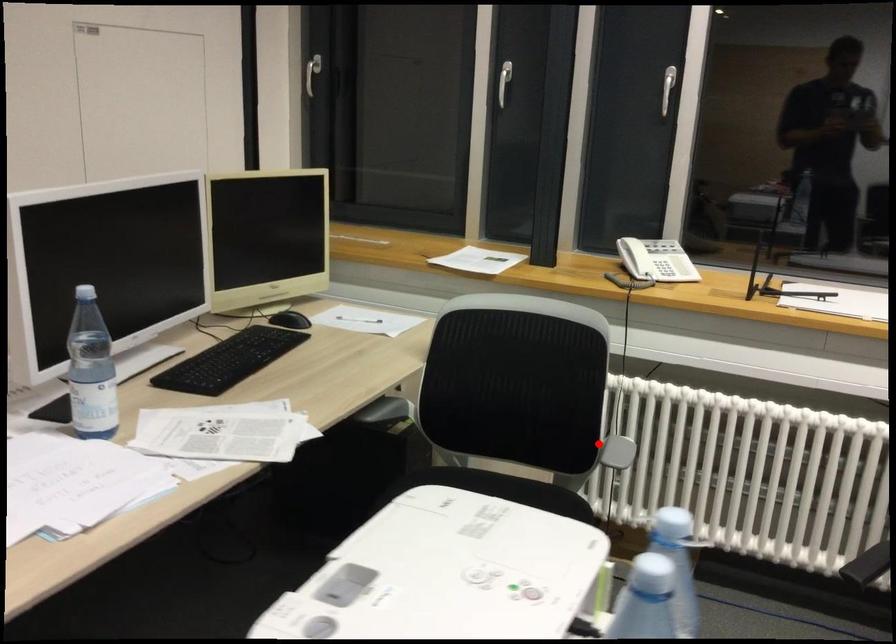
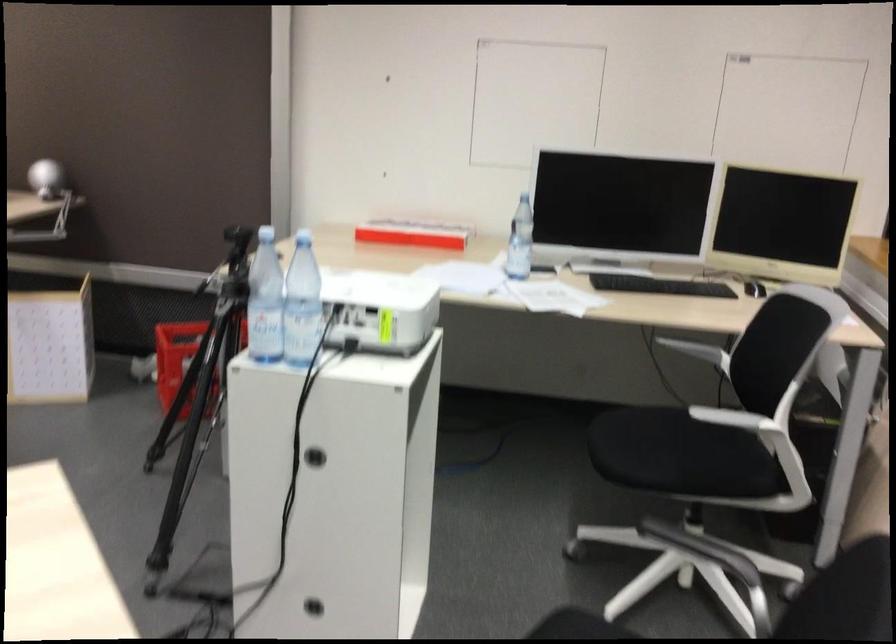
Find the pixel in the second image that matches the highlighted location in the first image.

(733, 418)